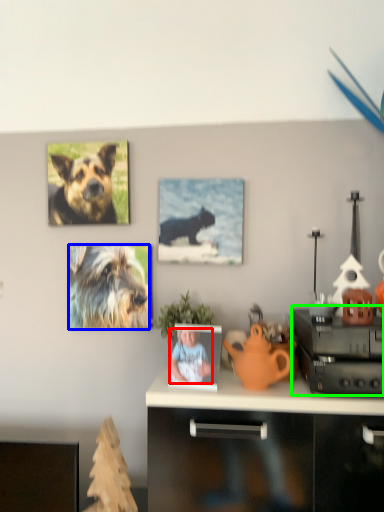
Question: Which is farther away from person (highlighted by a red box)? dog (highlighted by a blue box) or cabinetry (highlighted by a green box)?

Choices:
 (A) dog
 (B) cabinetry

Answer: (A)